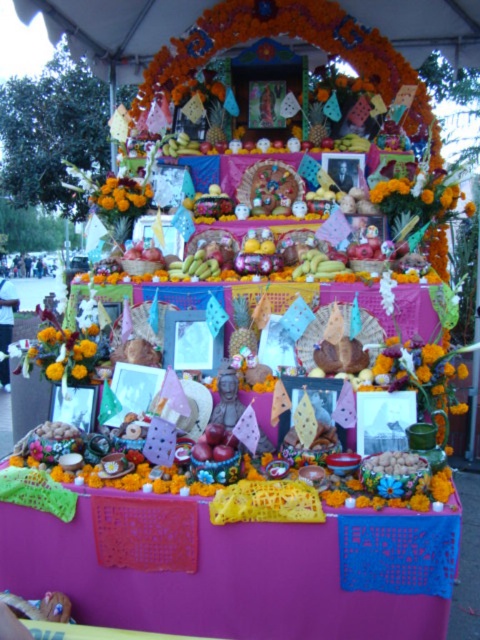
You are setting up an ofrenda for the Day of the Dead and need to ensure that all floral elements are visible. Given that you have an orange marigold at upper right and an orange matte flower at center, which flower should be placed higher to ensure visibility?

The orange marigold at upper right should be placed higher because it already has a greater height compared to the orange matte flower at center, making it more noticeable from a distance.

You are standing in front of an ofrenda and want to place a candle on the purple fabric table at center. To avoid blocking the orange marigold at upper right, where should you position the candle?

The purple fabric table at center is located below the orange marigold at upper right, so placing the candle on the purple fabric table at center would not block the orange marigold at upper right as it is positioned below it.